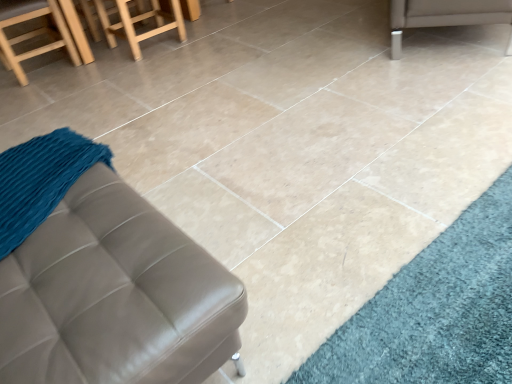
Question: From a real-world perspective, is wooden stool at upper left positioned under wooden stool at upper left based on gravity?

Choices:
 (A) no
 (B) yes

Answer: (A)

Question: Considering the relative sizes of wooden stool at upper left and wooden stool at upper left in the image provided, is wooden stool at upper left bigger than wooden stool at upper left?

Choices:
 (A) no
 (B) yes

Answer: (B)

Question: Can you see wooden stool at upper left touching wooden stool at upper left?

Choices:
 (A) yes
 (B) no

Answer: (B)

Question: Is wooden stool at upper left far from wooden stool at upper left?

Choices:
 (A) yes
 (B) no

Answer: (B)

Question: Can you confirm if wooden stool at upper left is wider than wooden stool at upper left?

Choices:
 (A) no
 (B) yes

Answer: (A)

Question: Considering the relative sizes of wooden stool at upper left and wooden stool at upper left in the image provided, is wooden stool at upper left shorter than wooden stool at upper left?

Choices:
 (A) yes
 (B) no

Answer: (B)

Question: Considering the relative sizes of wooden stool at upper left and silver metallic leg at upper right, the second furniture positioned from the bottom, in the image provided, is wooden stool at upper left smaller than silver metallic leg at upper right, the second furniture positioned from the bottom,?

Choices:
 (A) no
 (B) yes

Answer: (B)

Question: Are wooden stool at upper left and silver metallic leg at upper right, marked as the first furniture in a right-to-left arrangement, located far from each other?

Choices:
 (A) yes
 (B) no

Answer: (A)

Question: Can you confirm if wooden stool at upper left is shorter than silver metallic leg at upper right, marked as the first furniture in a right-to-left arrangement?

Choices:
 (A) no
 (B) yes

Answer: (A)

Question: Does wooden stool at upper left come behind silver metallic leg at upper right, marked as the first furniture in a right-to-left arrangement?

Choices:
 (A) no
 (B) yes

Answer: (B)

Question: Does wooden stool at upper left touch silver metallic leg at upper right, the second furniture viewed from the front?

Choices:
 (A) no
 (B) yes

Answer: (A)

Question: Is wooden stool at upper left at the right side of silver metallic leg at upper right, the second furniture positioned from the bottom?

Choices:
 (A) no
 (B) yes

Answer: (A)

Question: Could you tell me if wooden stool at upper left is facing leather ottoman at lower left, acting as the 2th furniture starting from the right?

Choices:
 (A) no
 (B) yes

Answer: (A)